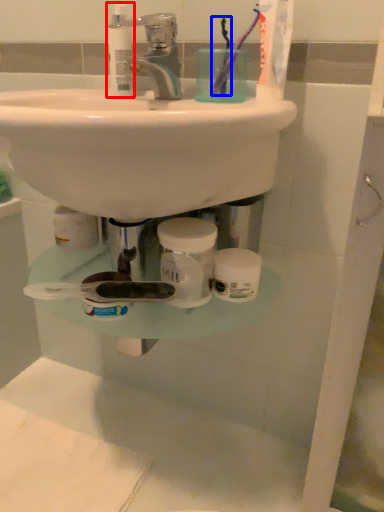
Question: Which of the following is the farthest to the observer, mouthwash (highlighted by a red box) or toothbrush (highlighted by a blue box)?

Choices:
 (A) mouthwash
 (B) toothbrush

Answer: (A)